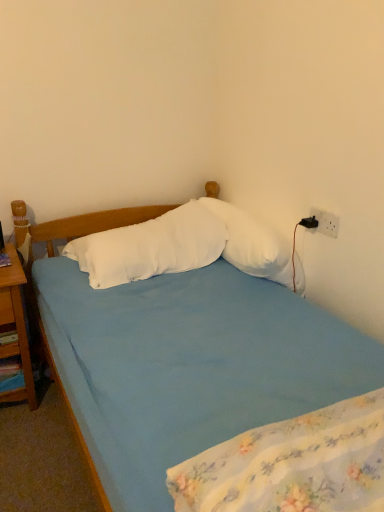
Question: Can you confirm if blue fabric mattress at lower center is thinner than wooden nightstand at left?

Choices:
 (A) no
 (B) yes

Answer: (B)

Question: Considering the relative sizes of blue fabric mattress at lower center and wooden nightstand at left in the image provided, is blue fabric mattress at lower center taller than wooden nightstand at left?

Choices:
 (A) no
 (B) yes

Answer: (A)

Question: Is blue fabric mattress at lower center beside wooden nightstand at left?

Choices:
 (A) yes
 (B) no

Answer: (B)

Question: Is blue fabric mattress at lower center closer to the viewer compared to wooden nightstand at left?

Choices:
 (A) no
 (B) yes

Answer: (B)

Question: From the image's perspective, does blue fabric mattress at lower center appear higher than wooden nightstand at left?

Choices:
 (A) no
 (B) yes

Answer: (A)

Question: From a real-world perspective, is blue fabric mattress at lower center positioned under wooden nightstand at left based on gravity?

Choices:
 (A) yes
 (B) no

Answer: (B)

Question: Considering the relative positions of wooden nightstand at left and white soft pillow at center, the first pillow in the right-to-left sequence, in the image provided, is wooden nightstand at left to the left of white soft pillow at center, the first pillow in the right-to-left sequence, from the viewer's perspective?

Choices:
 (A) no
 (B) yes

Answer: (B)

Question: Can you confirm if wooden nightstand at left is wider than white soft pillow at center, the first pillow in the right-to-left sequence?

Choices:
 (A) no
 (B) yes

Answer: (B)

Question: From the image's perspective, is wooden nightstand at left under white soft pillow at center, the first pillow in the right-to-left sequence?

Choices:
 (A) yes
 (B) no

Answer: (A)

Question: From the image's perspective, is wooden nightstand at left on white soft pillow at center, which is counted as the 2th pillow, starting from the left?

Choices:
 (A) yes
 (B) no

Answer: (B)

Question: Is wooden nightstand at left shorter than white soft pillow at center, the first pillow in the right-to-left sequence?

Choices:
 (A) yes
 (B) no

Answer: (B)

Question: From a real-world perspective, is wooden nightstand at left positioned under white soft pillow at center, the first pillow in the right-to-left sequence, based on gravity?

Choices:
 (A) no
 (B) yes

Answer: (B)

Question: Does white soft pillow at center, the first pillow in the right-to-left sequence, have a greater height compared to blue fabric mattress at lower center?

Choices:
 (A) no
 (B) yes

Answer: (A)